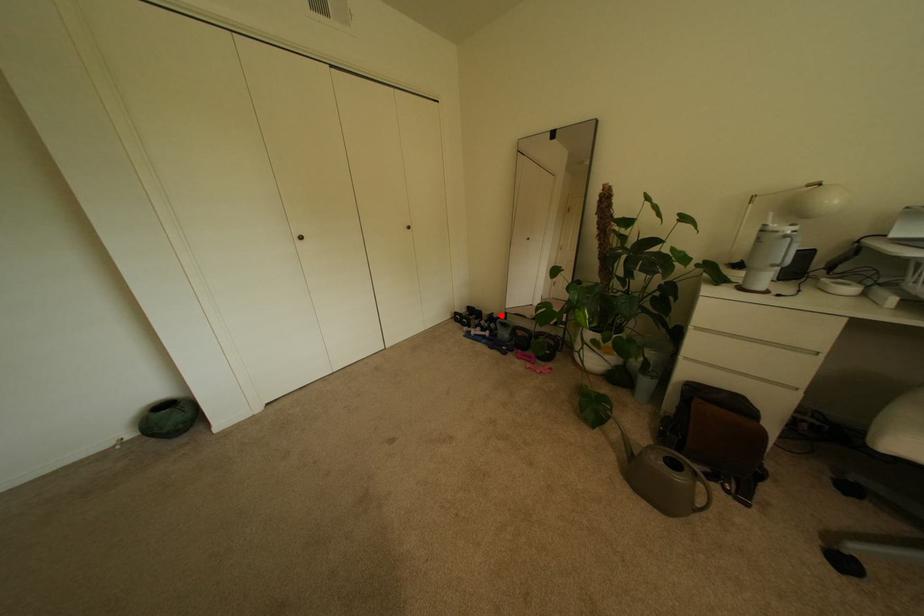
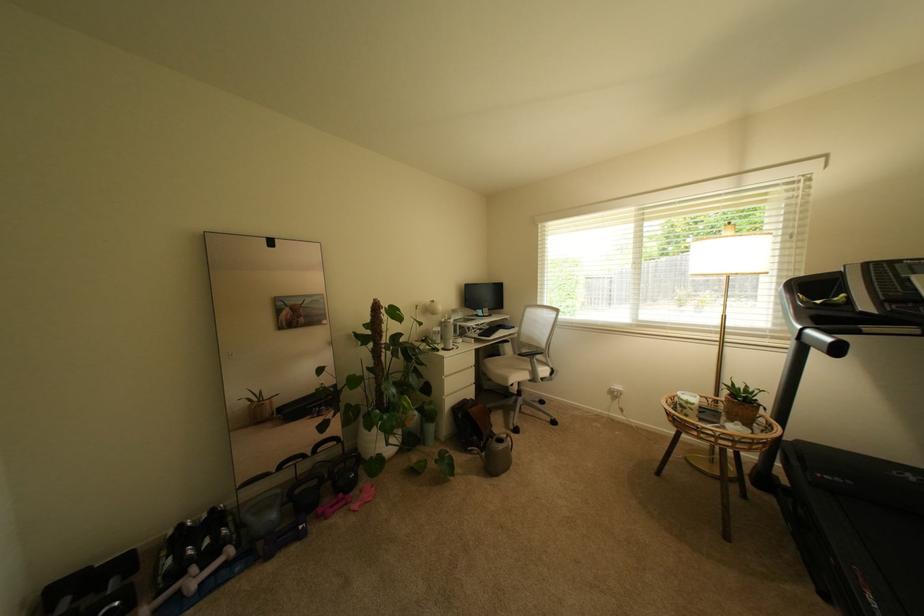
Question: I am providing you with two images of the same scene from different viewpoints. A red point is shown in image1. For the corresponding object point in image2, is it positioned nearer or farther from the camera?

Choices:
 (A) Nearer
 (B) Farther

Answer: (A)